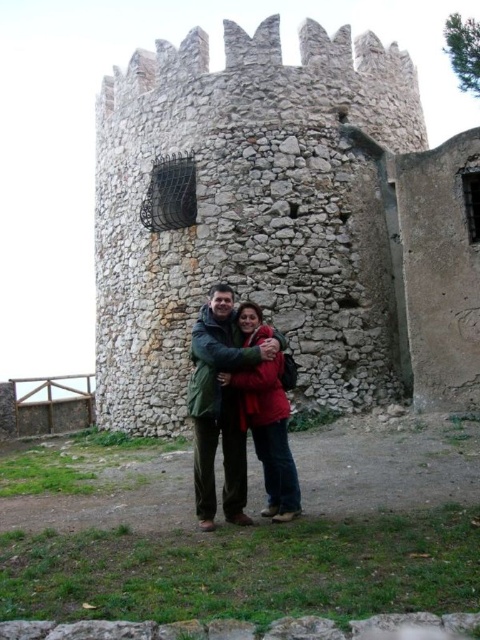
Question: Can you confirm if stone wall at center is smaller than green wool coat at center?

Choices:
 (A) yes
 (B) no

Answer: (B)

Question: Which point is closer to the camera?

Choices:
 (A) green wool coat at center
 (B) stone wall at center

Answer: (A)

Question: Does stone wall at center appear on the right side of green wool coat at center?

Choices:
 (A) no
 (B) yes

Answer: (B)

Question: In this image, where is stone wall at center located relative to green wool coat at center?

Choices:
 (A) above
 (B) below

Answer: (A)